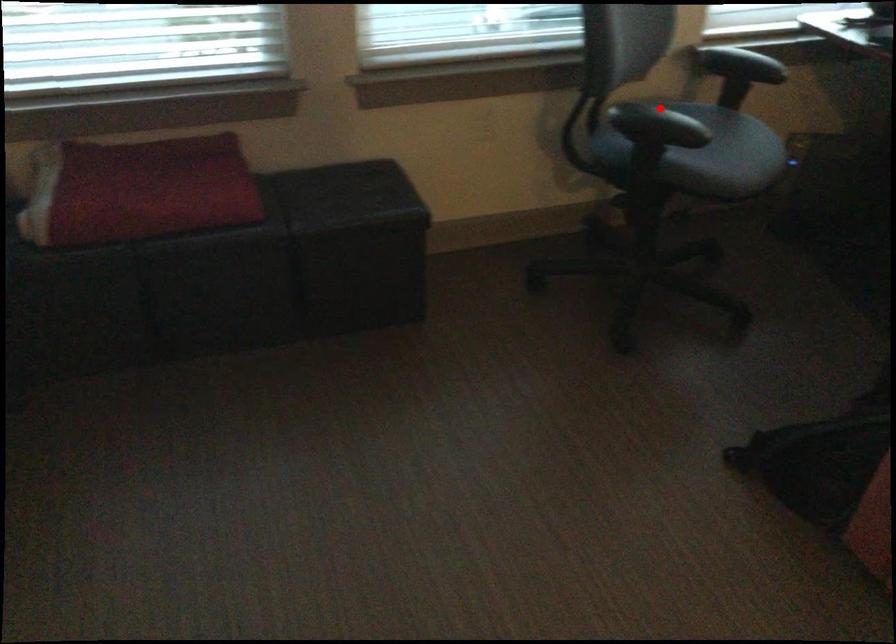
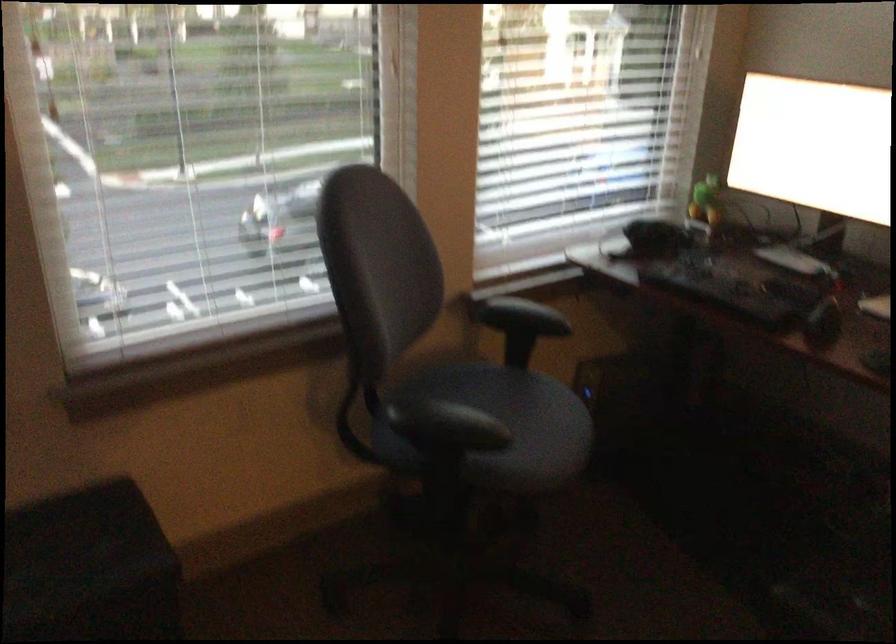
Find the pixel in the second image that matches the highlighted location in the first image.

(443, 424)